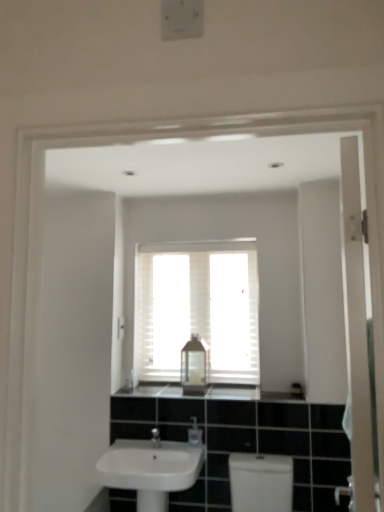
Describe the element at coordinates (195, 433) in the screenshot. I see `clear plastic soap dispenser at center` at that location.

In order to face transparent plastic bottle at center, should I rotate leftwards or rightwards?

Turn right approximately 0.327 degrees to face it.

Find the location of a particular element. Image resolution: width=384 pixels, height=512 pixels. black granite countertop at center is located at coordinates (211, 393).

Consider the image. Measure the distance between white plastic light switch at upper center and camera.

They are 8.88 feet apart.

What do you see at coordinates (197, 309) in the screenshot? I see `white matte window at center` at bounding box center [197, 309].

You are a GUI agent. You are given a task and a screenshot of the screen. Output one action in this format:
    pyautogui.click(x=<x>, y=<y>)
    Task: Click on the white glossy door at right
    
    Given the screenshot: What is the action you would take?
    pyautogui.click(x=356, y=332)

Based on their sizes in the image, would you say white glossy toilet at lower center is bigger or smaller than white matte window at center?

Clearly, white glossy toilet at lower center is larger in size than white matte window at center.

From the image's perspective, is white glossy toilet at lower center on white matte window at center?

No.

In terms of height, does white glossy toilet at lower center look taller or shorter compared to white matte window at center?

In the image, white glossy toilet at lower center appears to be shorter than white matte window at center.

Can you confirm if white glossy toilet at lower center is wider than white matte window at center?

Correct, the width of white glossy toilet at lower center exceeds that of white matte window at center.

Is white matte window at center facing away from white glossy sink at lower center?

white matte window at center is not turned away from white glossy sink at lower center.

From the image's perspective, between white matte window at center and white glossy sink at lower center, which one is located above?

white matte window at center is shown above in the image.

Can you confirm if white matte window at center is thinner than white glossy sink at lower center?

Indeed, white matte window at center has a lesser width compared to white glossy sink at lower center.

Considering the positions of objects white matte window at center and white glossy sink at lower center in the image provided, who is more to the right, white matte window at center or white glossy sink at lower center?

From the viewer's perspective, white matte window at center appears more on the right side.

Considering the relative sizes of black granite countertop at center and white matte window at center in the image provided, is black granite countertop at center wider than white matte window at center?

Indeed, black granite countertop at center has a greater width compared to white matte window at center.

From the image's perspective, is black granite countertop at center above or below white matte window at center?

Clearly, from the image's perspective, black granite countertop at center is below white matte window at center.

Which of these two, black granite countertop at center or white matte window at center, is bigger?

white matte window at center.

Does point (195, 390) lie in front of point (213, 256)?

Yes, it is.

Which of these two, white plastic light switch at upper center or white matte window at center, is thinner?

white plastic light switch at upper center.

Is white matte window at center at the back of white plastic light switch at upper center?

No, white matte window at center is not at the back of white plastic light switch at upper center.

From the image's perspective, which one is positioned higher, white plastic light switch at upper center or white matte window at center?

white matte window at center is shown above in the image.

Does point (119, 337) lie behind point (203, 337)?

No, (119, 337) is in front of (203, 337).

From a real-world perspective, is white glossy door at right located higher than transparent plastic bottle at center?

Yes, from a real-world perspective, white glossy door at right is over transparent plastic bottle at center

Can we say white glossy door at right lies outside transparent plastic bottle at center?

Yes.

Is white glossy door at right turned away from transparent plastic bottle at center?

No, white glossy door at right's orientation is not away from transparent plastic bottle at center.

Based on their positions, is white glossy door at right located to the left or right of transparent plastic bottle at center?

From the image, it's evident that white glossy door at right is to the right of transparent plastic bottle at center.

Between transparent plastic bottle at center and black granite countertop at center, which one appears on the left side from the viewer's perspective?

Positioned to the left is transparent plastic bottle at center.

Is transparent plastic bottle at center taller or shorter than black granite countertop at center?

transparent plastic bottle at center is taller than black granite countertop at center.

Is transparent plastic bottle at center turned away from black granite countertop at center?

No, transparent plastic bottle at center is not facing the opposite direction of black granite countertop at center.

Considering the sizes of objects white matte window at center and white glossy door at right in the image provided, who is smaller, white matte window at center or white glossy door at right?

With smaller size is white matte window at center.

Who is shorter, white matte window at center or white glossy door at right?

With less height is white matte window at center.

Is white matte window at center touching white glossy door at right?

white matte window at center and white glossy door at right are clearly separated.

Can we say white matte window at center lies outside white glossy door at right?

Absolutely, white matte window at center is external to white glossy door at right.

Image resolution: width=384 pixels, height=512 pixels. I want to click on window above the white glossy toilet at lower center (from a real-world perspective), so click(x=197, y=309).

At what (x,y) coordinates should I click in order to perform the action: click on window above the white glossy sink at lower center (from the image's perspective). Please return your answer as a coordinate pair (x, y). Looking at the image, I should click on (197, 309).

When comparing their distances from transparent plastic bottle at center, does white matte window at center or clear plastic soap dispenser at center seem further?

white matte window at center lies further to transparent plastic bottle at center than the other object.

Looking at the image, which one is located closer to black granite countertop at center, white matte window at center or transparent plastic bottle at center?

transparent plastic bottle at center lies closer to black granite countertop at center than the other object.

When comparing their distances from clear plastic soap dispenser at center, does white glossy door at right or white matte window at center seem closer?

Based on the image, white matte window at center appears to be nearer to clear plastic soap dispenser at center.

Based on their spatial positions, is transparent plastic bottle at center or white matte window at center further from white glossy sink at lower center?

white matte window at center.

Based on their spatial positions, is white glossy sink at lower center or transparent plastic bottle at center closer to clear plastic soap dispenser at center?

Among the two, white glossy sink at lower center is located nearer to clear plastic soap dispenser at center.

When comparing their distances from clear plastic soap dispenser at center, does white plastic light switch at upper center or white glossy toilet at lower center seem closer?

The object closer to clear plastic soap dispenser at center is white glossy toilet at lower center.

Which object lies further to the anchor point white glossy toilet at lower center, white matte window at center or white glossy door at right?

Among the two, white glossy door at right is located further to white glossy toilet at lower center.

Which object lies further to the anchor point white plastic light switch at upper center, white glossy door at right or white glossy toilet at lower center?

white glossy door at right.

Find the location of `counter top between white glossy door at right and white matte window at center in the front-back direction`. counter top between white glossy door at right and white matte window at center in the front-back direction is located at coordinates (211, 393).

At what (x,y) coordinates should I click in order to perform the action: click on counter top positioned between white glossy toilet at lower center and white matte window at center from near to far. Please return your answer as a coordinate pair (x, y). Looking at the image, I should click on (211, 393).

Locate an element on the screen. The image size is (384, 512). toilet bowl positioned between white glossy door at right and white matte window at center from near to far is located at coordinates (261, 482).

Locate an element on the screen. The image size is (384, 512). toiletry between white glossy toilet at lower center and white matte window at center in the front-back direction is located at coordinates (195, 433).